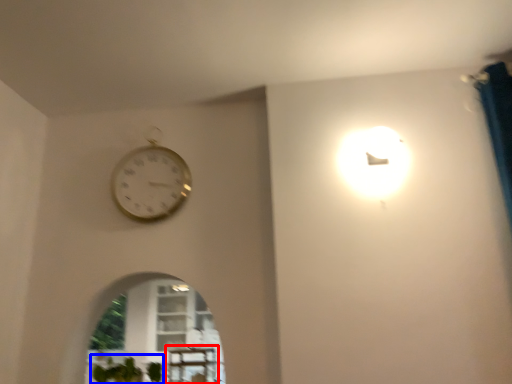
Question: Which object is further to the camera taking this photo, table (highlighted by a red box) or plant (highlighted by a blue box)?

Choices:
 (A) table
 (B) plant

Answer: (A)